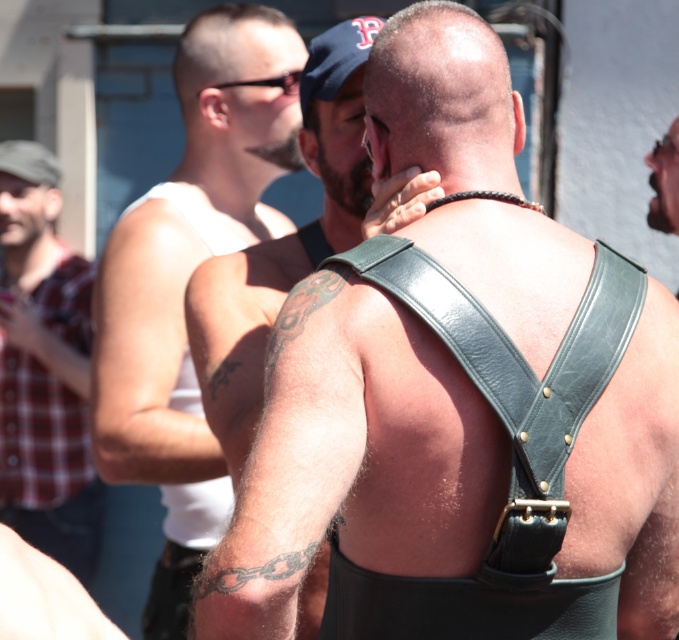
You are a photographer standing at a distance of 10 feet from the scene. You want to capture a photo where both the white leather tank top at left and black leather suspenders at center are in focus. Given that your camera can focus on objects within a 5 feet range, will both items be in focus?

The white leather tank top at left and black leather suspenders at center are 5.33 feet apart from each other. Since the camera can only focus within a 5 feet range, the distance between them exceeds this limit, so both items cannot be in focus simultaneously.

You are a photographer at this gathering and want to capture both the white leather tank top at left and the black leather suspenders at center in a single frame. Which object should you focus on first if you want to ensure both are in focus?

The white leather tank top at left is taller than the black leather suspenders at center, so focusing on the white leather tank top at left first would help ensure both are in focus as it is the larger subject.

You are a photographer at this gathering. You want to take a closeup shot of the dark grey tattooed arm at center but need to ensure the leather harness at center isn not blocking it. Can you do that?

The leather harness at center is positioned over the dark grey tattooed arm at center, so it is currently blocking the view. To capture the tattoo without obstruction, you would need to adjust the subject or harness position to move the leather harness at center away from the dark grey tattooed arm at center.